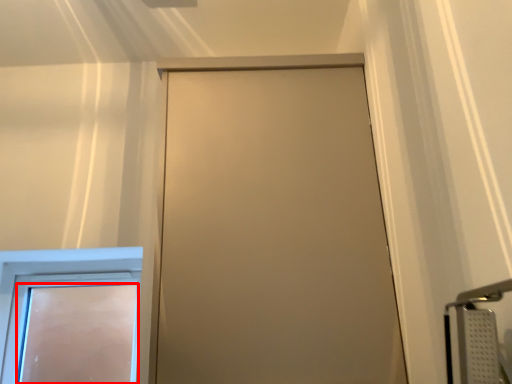
Question: From the image's perspective, considering the relative positions of door (annotated by the red box) and door in the image provided, where is door (annotated by the red box) located with respect to the staircase?

Choices:
 (A) above
 (B) below

Answer: (B)